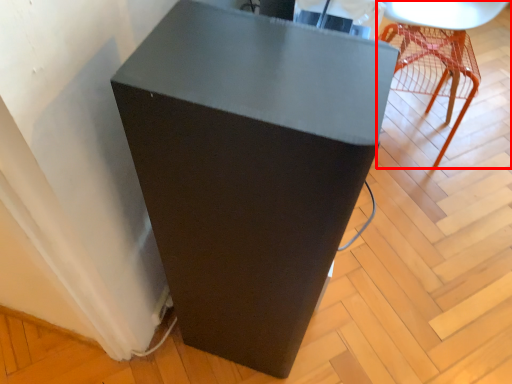
Question: From the image's perspective, where is furniture (annotated by the red box) located relative to furniture?

Choices:
 (A) above
 (B) below

Answer: (A)